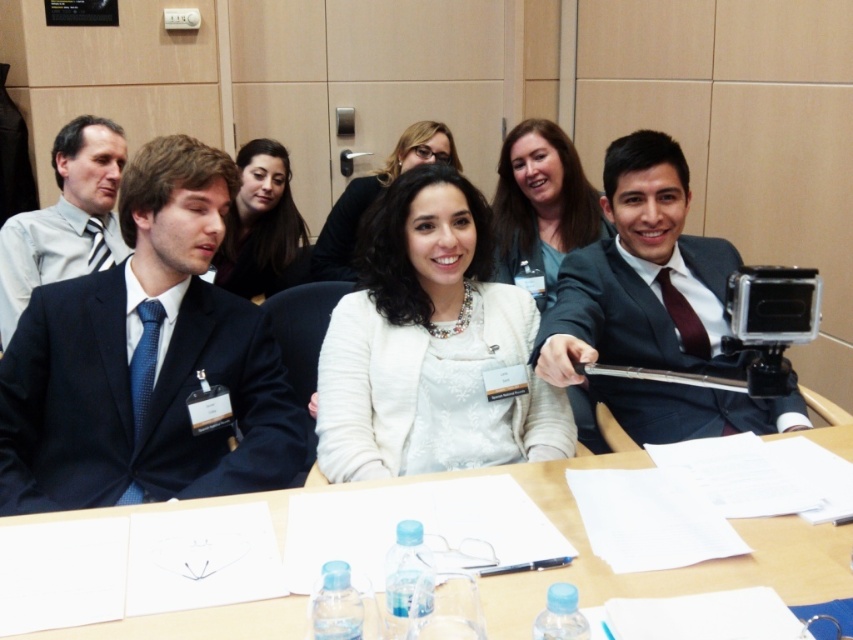
You are attending a virtual meeting and want to see the name tags of the participants. However, the camera is blocking your view of the white matte sweater at center and the white fabric jacket at center. Which clothing item is covering the other?

The white fabric jacket at center is covering the white matte sweater at center because the white matte sweater at center is positioned under the white fabric jacket at center.